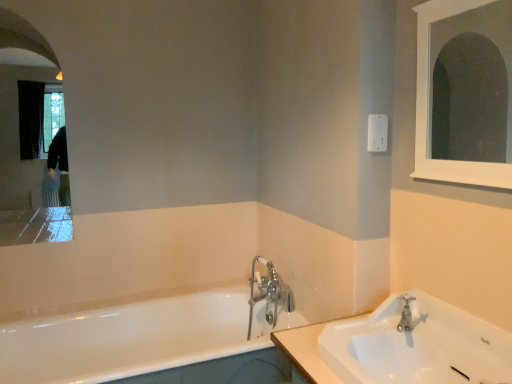
Question: Is white wooden medicine cabinet at upper right, arranged as the 2th medicine cabinet when viewed from the back, shorter than white glossy sink at lower right?

Choices:
 (A) yes
 (B) no

Answer: (B)

Question: Is white wooden medicine cabinet at upper right, which ranks as the second medicine cabinet in left-to-right order, to the left of white glossy sink at lower right from the viewer's perspective?

Choices:
 (A) no
 (B) yes

Answer: (A)

Question: Considering the relative sizes of white wooden medicine cabinet at upper right, the first medicine cabinet viewed from the right, and white glossy sink at lower right in the image provided, is white wooden medicine cabinet at upper right, the first medicine cabinet viewed from the right, taller than white glossy sink at lower right?

Choices:
 (A) yes
 (B) no

Answer: (A)

Question: Is white wooden medicine cabinet at upper right, placed as the first medicine cabinet when sorted from front to back, turned away from white glossy sink at lower right?

Choices:
 (A) no
 (B) yes

Answer: (A)

Question: From the image's perspective, is white wooden medicine cabinet at upper right, placed as the first medicine cabinet when sorted from front to back, above white glossy sink at lower right?

Choices:
 (A) yes
 (B) no

Answer: (A)

Question: From a real-world perspective, is silver metallic faucet at sink right, the 1th tap from the right, physically located above or below chrome metallic faucet at center, which ranks as the 2th tap in right-to-left order?

Choices:
 (A) below
 (B) above

Answer: (B)

Question: From the image's perspective, is silver metallic faucet at sink right, positioned as the 2th tap in left-to-right order, located above or below chrome metallic faucet at center, the first tap from the left?

Choices:
 (A) below
 (B) above

Answer: (B)

Question: Would you say silver metallic faucet at sink right, positioned as the 2th tap in left-to-right order, is inside or outside chrome metallic faucet at center, the second tap when ordered from front to back?

Choices:
 (A) inside
 (B) outside

Answer: (B)

Question: Based on their sizes in the image, would you say silver metallic faucet at sink right, the 1th tap from the right, is bigger or smaller than chrome metallic faucet at center, the second tap when ordered from front to back?

Choices:
 (A) small
 (B) big

Answer: (A)

Question: Considering the positions of chrome metallic faucet at center, the first tap from the left, and white plastic electric outlet at upper right in the image, is chrome metallic faucet at center, the first tap from the left, wider or thinner than white plastic electric outlet at upper right?

Choices:
 (A) thin
 (B) wide

Answer: (B)

Question: Is chrome metallic faucet at center, the first tap from the left, taller or shorter than white plastic electric outlet at upper right?

Choices:
 (A) short
 (B) tall

Answer: (B)

Question: From the image's perspective, is chrome metallic faucet at center, the second tap when ordered from front to back, positioned above or below white plastic electric outlet at upper right?

Choices:
 (A) above
 (B) below

Answer: (B)

Question: From a real-world perspective, is chrome metallic faucet at center, the first tap from the left, positioned above or below white plastic electric outlet at upper right?

Choices:
 (A) above
 (B) below

Answer: (B)

Question: From a real-world perspective, is white plastic electric outlet at upper right physically located above or below silver metallic faucet at sink right, the 1th tap from the right?

Choices:
 (A) below
 (B) above

Answer: (B)

Question: In the image, is white plastic electric outlet at upper right positioned in front of or behind silver metallic faucet at sink right, positioned as the 2th tap in left-to-right order?

Choices:
 (A) front
 (B) behind

Answer: (B)